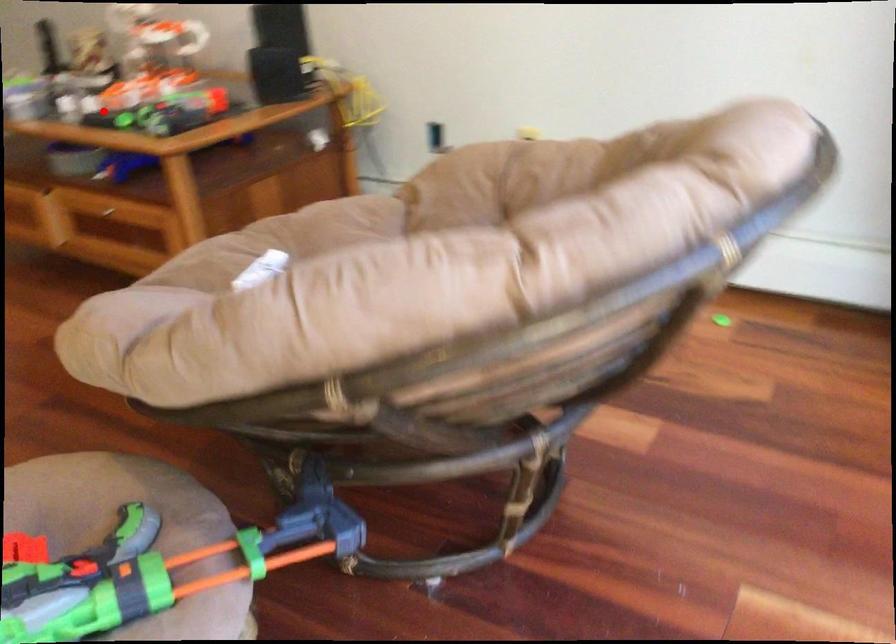
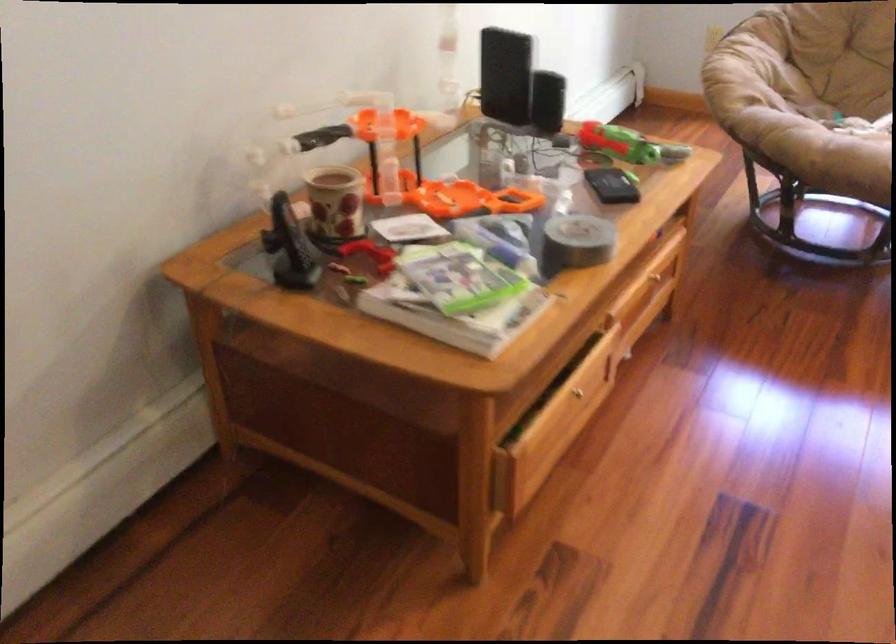
Question: I am providing you with two images of the same scene from different viewpoints. Image1 has a red point marked. In image2, the corresponding 3D location appears at what relative position? Reply with the corresponding letter.

Choices:
 (A) Closer
 (B) Farther

Answer: (A)